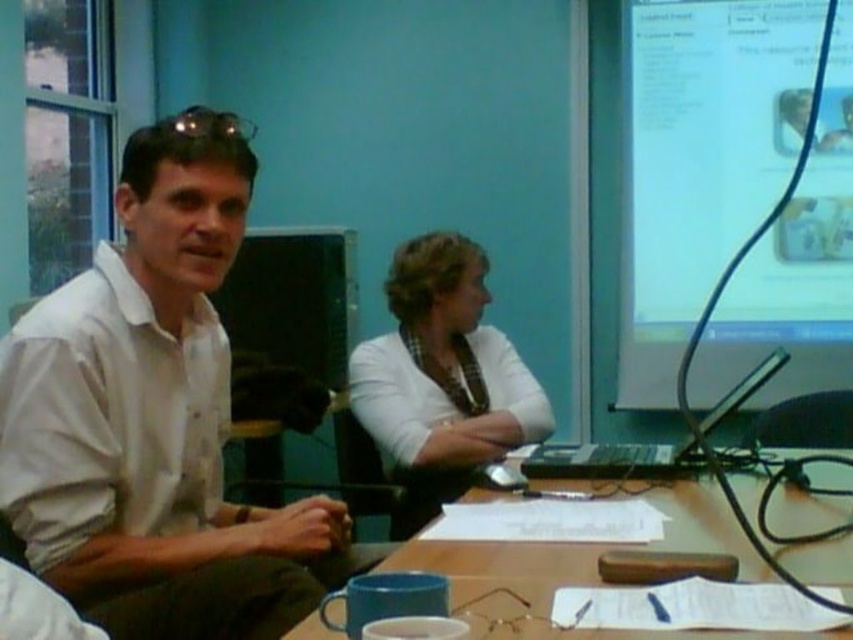
Is matte plastic projector screen at upper right taller than white matte shirt at center?

Yes.

Image resolution: width=853 pixels, height=640 pixels. What do you see at coordinates (700, 160) in the screenshot? I see `matte plastic projector screen at upper right` at bounding box center [700, 160].

At what (x,y) coordinates should I click in order to perform the action: click on matte plastic projector screen at upper right. Please return your answer as a coordinate pair (x, y). The height and width of the screenshot is (640, 853). Looking at the image, I should click on (700, 160).

Where is `matte plastic projector screen at upper right`? The width and height of the screenshot is (853, 640). matte plastic projector screen at upper right is located at coordinates (700, 160).

Does matte plastic projector screen at upper right appear on the right side of black plastic computer at center?

Correct, you'll find matte plastic projector screen at upper right to the right of black plastic computer at center.

Who is more forward, (x=695, y=12) or (x=596, y=472)?

Point (x=596, y=472) is more forward.

Image resolution: width=853 pixels, height=640 pixels. I want to click on matte plastic projector screen at upper right, so click(700, 160).

Does point (750, 97) lie in front of point (425, 548)?

No, it is behind (425, 548).

Is matte plastic projector screen at upper right wider than wooden table at center?

In fact, matte plastic projector screen at upper right might be narrower than wooden table at center.

The height and width of the screenshot is (640, 853). Identify the location of matte plastic projector screen at upper right. (700, 160).